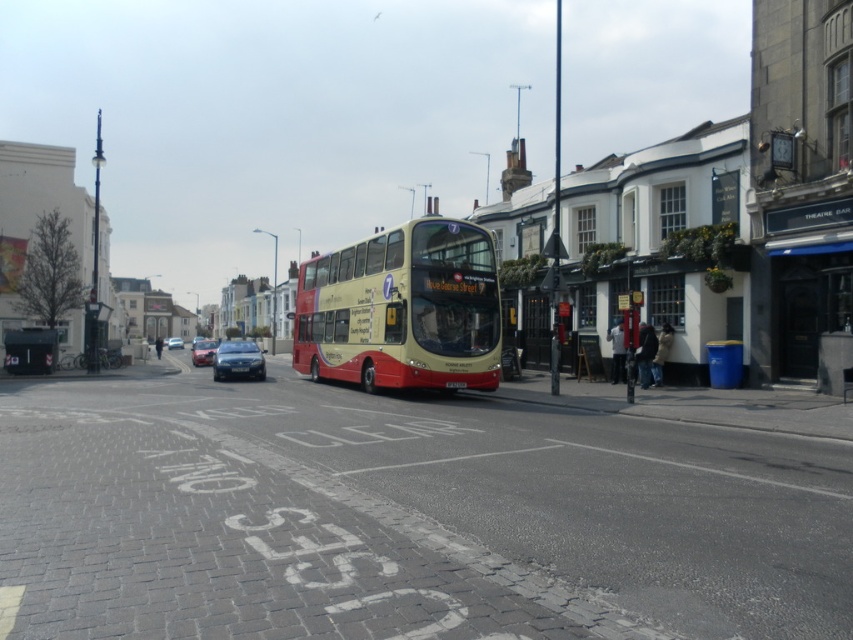
Consider the image. You are standing at the bus stop and want to know which of the two points, point (209, 358) or point (183, 348), is closer to you. Can you determine this based on the image?

Point (209, 358) is closer to the viewer than point (183, 348).